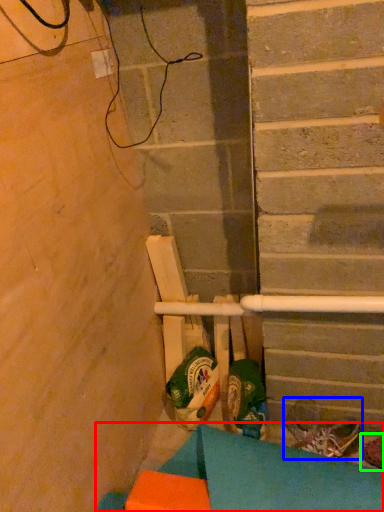
Question: Which object is the farthest from furniture (highlighted by a red box)? Choose among these: footwear (highlighted by a blue box) or footwear (highlighted by a green box).

Choices:
 (A) footwear
 (B) footwear

Answer: (B)